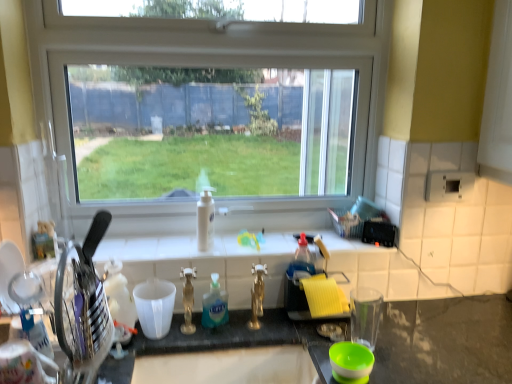
Question: From their relative heights in the image, would you say yellow sponge at right, the 2th appliance positioned from the front, is taller or shorter than transparent glass window at center?

Choices:
 (A) short
 (B) tall

Answer: (A)

Question: Based on their sizes in the image, would you say yellow sponge at right, marked as the 2th appliance in a left-to-right arrangement, is bigger or smaller than transparent glass window at center?

Choices:
 (A) big
 (B) small

Answer: (B)

Question: Estimate the real-world distances between objects in this image. Which object is farther from the yellow sponge at right, positioned as the 1th appliance in back-to-front order?

Choices:
 (A) white glossy bottle at center, which is counted as the first bottle, starting from the back
 (B) metallic knife block at left, which is the 1th appliance from front to back
 (C) transparent glass window at center
 (D) white tile at center
 (E) translucent plastic bottle at center, which is the 1th bottle in bottom-to-top order

Answer: (B)

Question: Which is farther from the white glossy bottle at center, which is counted as the first bottle, starting from the back?

Choices:
 (A) translucent plastic bottle at center, the 2th bottle positioned from the top
 (B) transparent glass window at center
 (C) white tile at center
 (D) metallic knife block at left, marked as the 2th appliance in a back-to-front arrangement
 (E) yellow sponge at right, positioned as the 1th appliance in back-to-front order

Answer: (D)